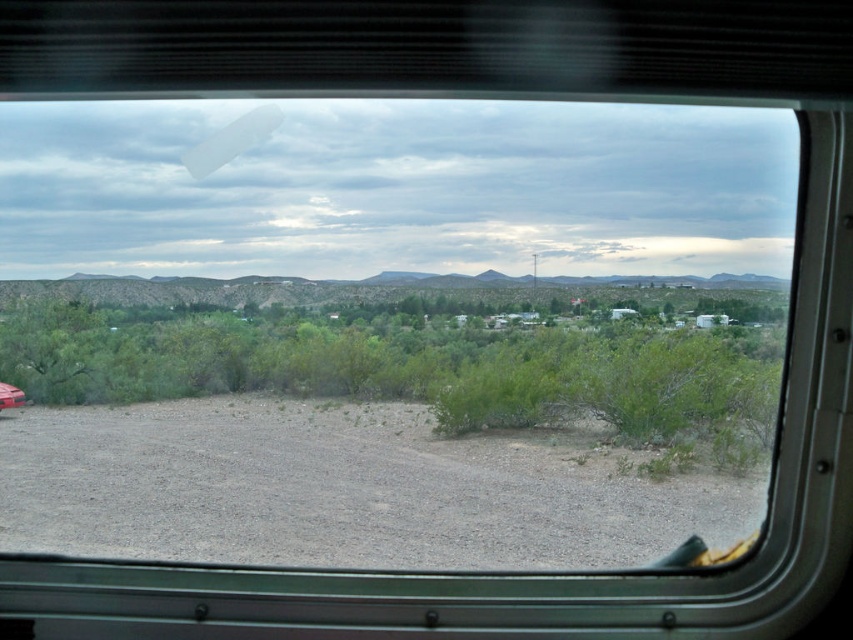
Question: Does gray gravel dirt track at lower left have a lesser width compared to matte red car at lower left?

Choices:
 (A) yes
 (B) no

Answer: (B)

Question: Can you confirm if gray gravel dirt track at lower left is wider than matte red car at lower left?

Choices:
 (A) no
 (B) yes

Answer: (B)

Question: Can you confirm if gray gravel dirt track at lower left is thinner than matte red car at lower left?

Choices:
 (A) yes
 (B) no

Answer: (B)

Question: Which point appears farthest from the camera in this image?

Choices:
 (A) (393, 467)
 (B) (15, 396)

Answer: (B)